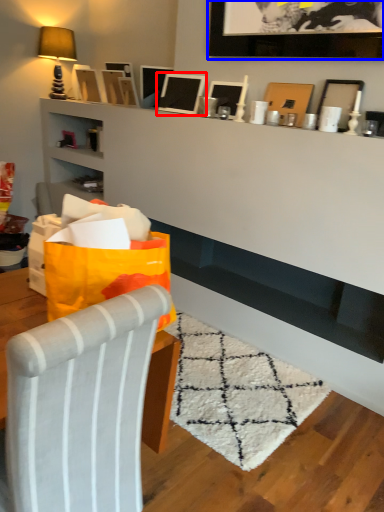
Question: Which object is further to the camera taking this photo, picture frame (highlighted by a red box) or picture frame (highlighted by a blue box)?

Choices:
 (A) picture frame
 (B) picture frame

Answer: (A)